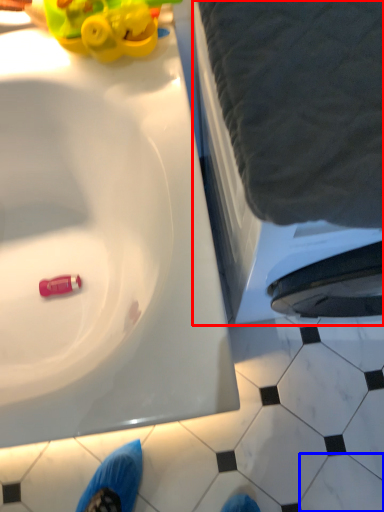
Question: Which point is closer to the camera, bath (highlighted by a red box) or tile (highlighted by a blue box)?

Choices:
 (A) bath
 (B) tile

Answer: (A)